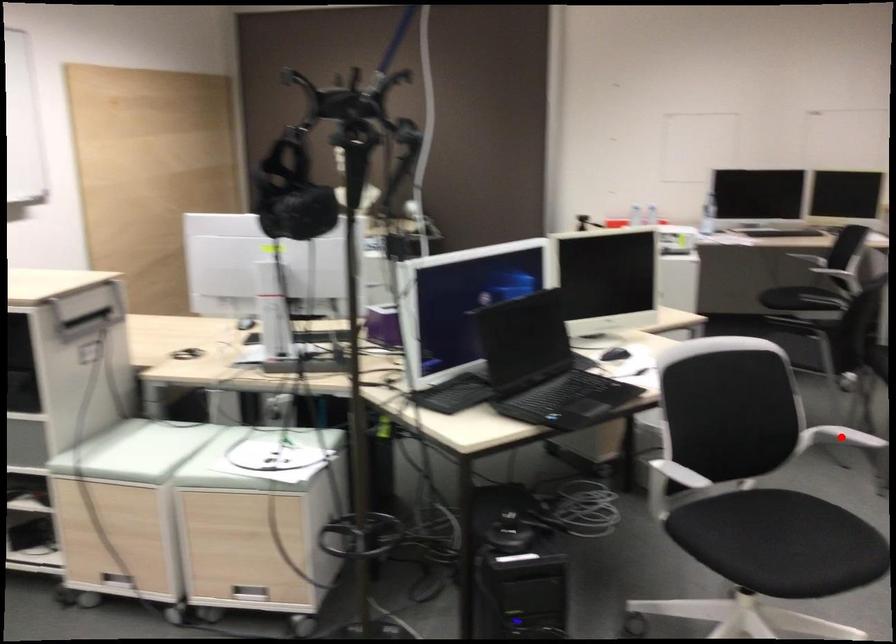
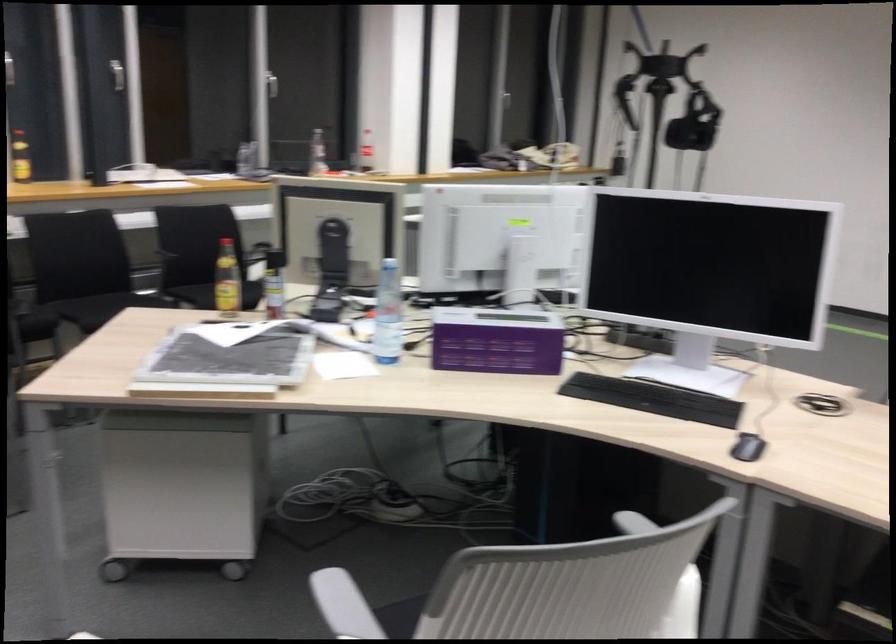
Question: I am providing you with two images of the same scene from different viewpoints. A red point is marked on the first image. Can you still see the location of the red point in image 2?

Choices:
 (A) Yes
 (B) No

Answer: (B)